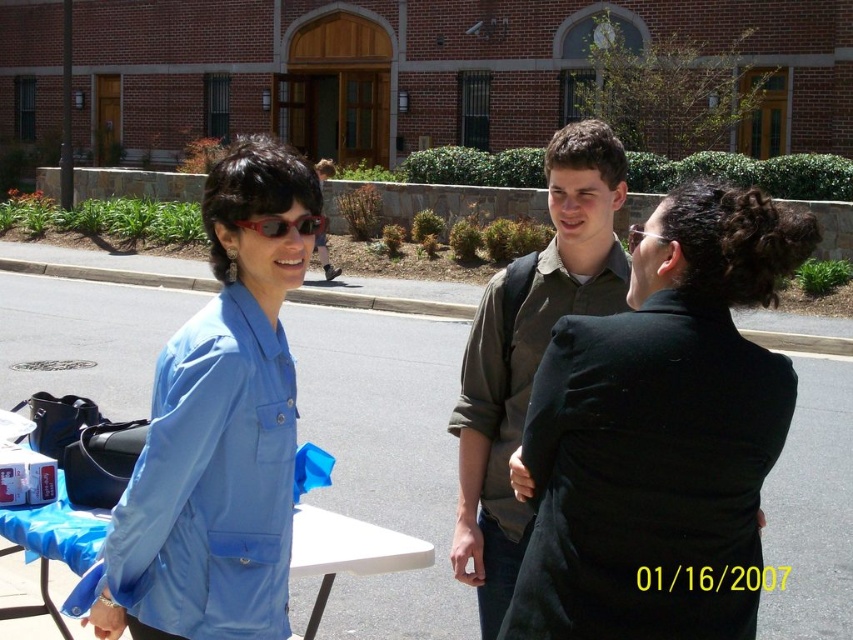
At what (x,y) coordinates should I click in order to perform the action: click on matte blue shirt at left. Please return your answer as a coordinate pair (x, y). Image resolution: width=853 pixels, height=640 pixels. Looking at the image, I should click on (219, 429).

Does matte blue shirt at left have a smaller size compared to blue fabric picnic table at lower left?

Correct, matte blue shirt at left occupies less space than blue fabric picnic table at lower left.

Identify the location of matte blue shirt at left. (219, 429).

I want to click on matte blue shirt at left, so click(x=219, y=429).

Does black matte jacket at center have a lesser width compared to matte black sunglasses at upper center?

Yes.

Does point (653, 563) come in front of point (322, 227)?

Yes.

The height and width of the screenshot is (640, 853). I want to click on black matte jacket at center, so click(x=660, y=435).

Is matte green shirt at center shorter than matte black sunglasses at upper center?

No, matte green shirt at center is not shorter than matte black sunglasses at upper center.

Does matte green shirt at center have a lesser width compared to matte black sunglasses at upper center?

Yes, matte green shirt at center is thinner than matte black sunglasses at upper center.

You are a GUI agent. You are given a task and a screenshot of the screen. Output one action in this format:
    pyautogui.click(x=<x>, y=<y>)
    Task: Click on the matte green shirt at center
    The image size is (853, 640).
    Given the screenshot: What is the action you would take?
    point(531,352)